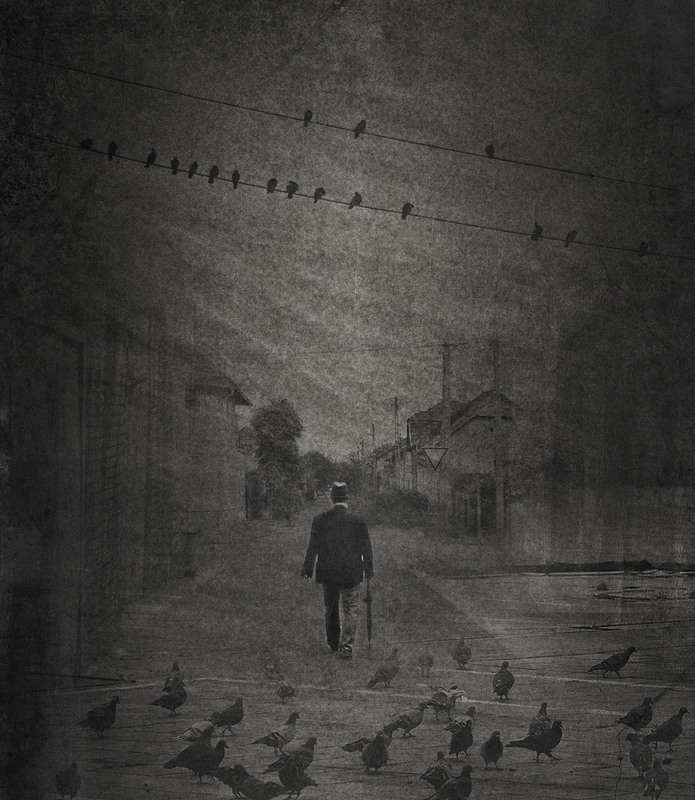
Image resolution: width=695 pixels, height=800 pixels. In order to click on art in this screenshot , I will do `click(297, 597)`.